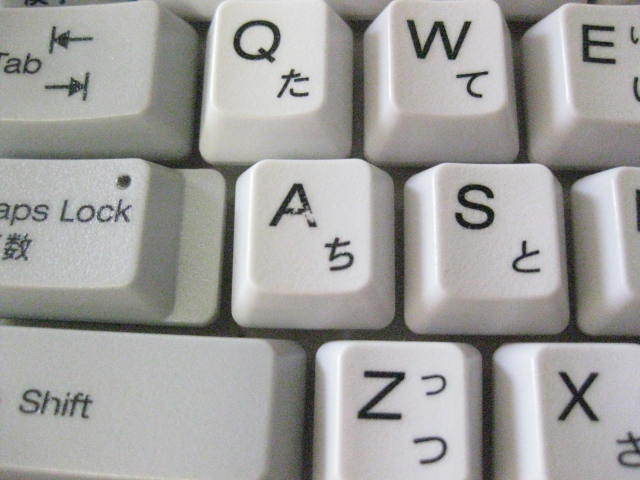
I want to click on typewriter, so click(326, 254).